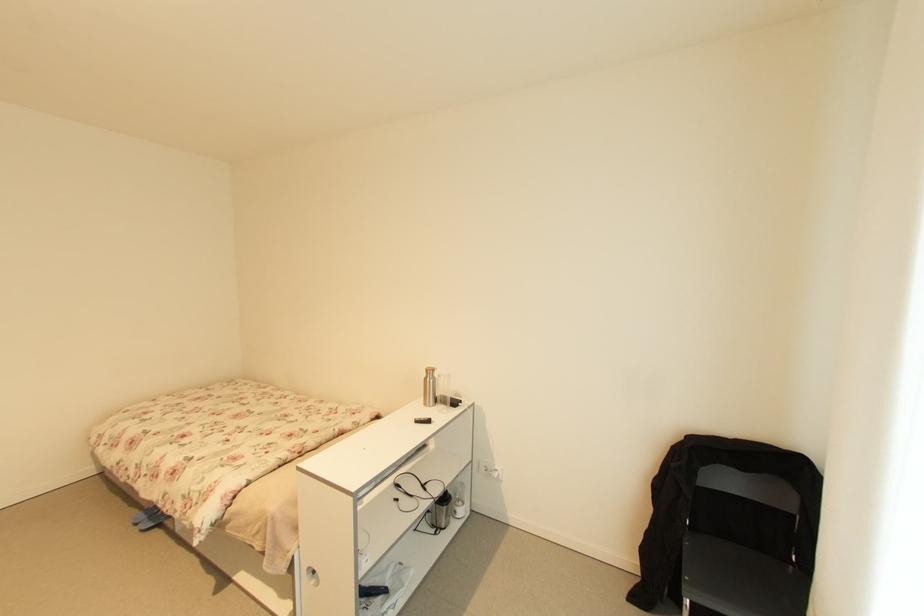
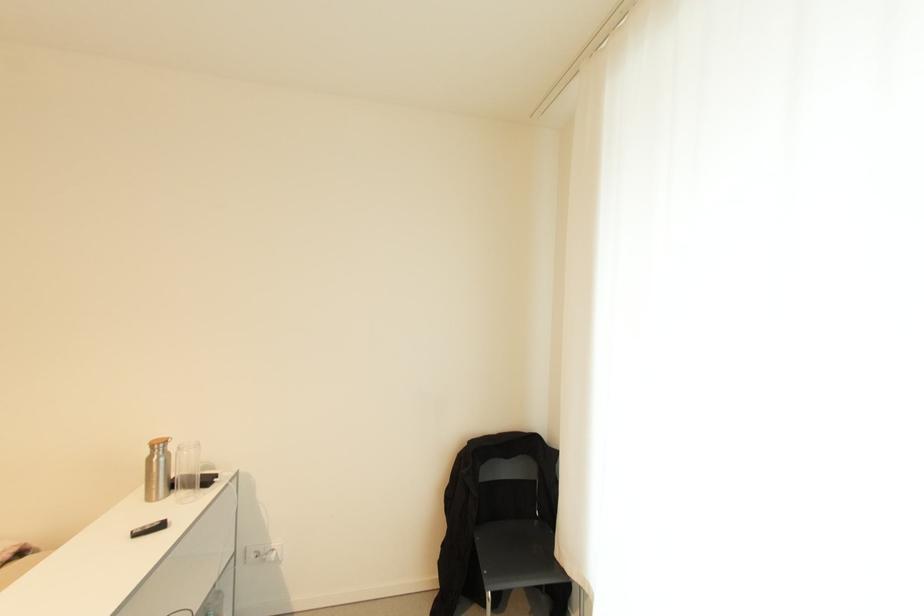
Question: Based on the continuous images, in which direction is the camera rotating? Reply with the corresponding letter.

Choices:
 (A) Left
 (B) Right
 (C) Up
 (D) Down

Answer: (B)